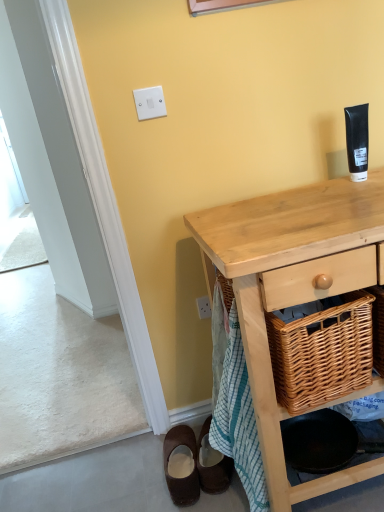
The height and width of the screenshot is (512, 384). I want to click on blank space above brown suede mule at lower left, the 2th footwear when ordered from right to left (from a real-world perspective), so click(180, 453).